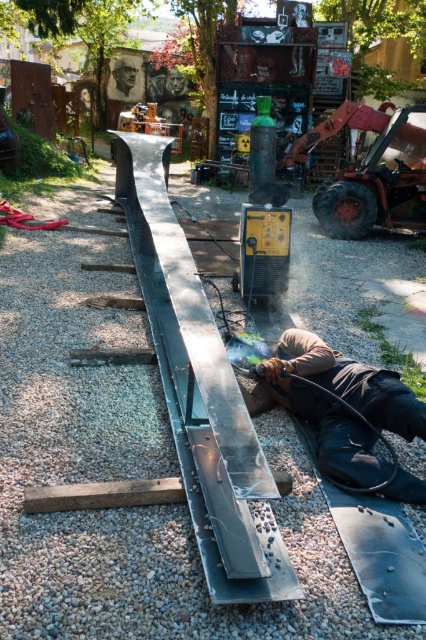
Question: Which object appears closest to the camera in this image?

Choices:
 (A) dark brown leather jacket at lower center
 (B) polished steel rail at center
 (C) metallic orange forklift at right
 (D) brown wood plank at lower left

Answer: (D)

Question: Is the position of gray gravel at center more distant than that of polished steel rail at center?

Choices:
 (A) yes
 (B) no

Answer: (B)

Question: Can you confirm if polished steel rail at center is bigger than metallic orange forklift at right?

Choices:
 (A) yes
 (B) no

Answer: (B)

Question: Can you confirm if gray gravel at center is positioned below dark brown leather jacket at lower center?

Choices:
 (A) no
 (B) yes

Answer: (B)

Question: Which object is farther from the camera taking this photo?

Choices:
 (A) polished steel rail at center
 (B) metallic orange forklift at right
 (C) dark brown leather jacket at lower center
 (D) brown wood plank at lower left

Answer: (B)

Question: Which object is closer to the camera taking this photo?

Choices:
 (A) brown wood plank at lower left
 (B) metallic orange forklift at right
 (C) dark brown leather jacket at lower center
 (D) gray gravel at center

Answer: (D)